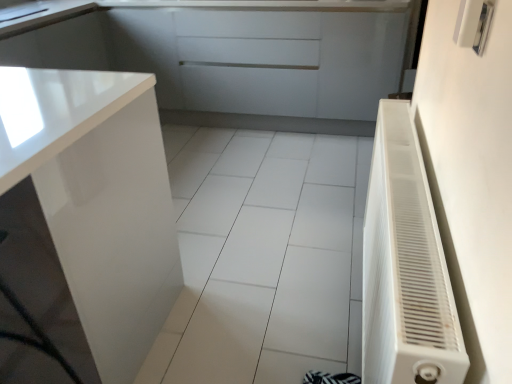
Question: Is glossy white cabinet at left, arranged as the first cabinetry when ordered from the bottom, located outside glossy white cabinet at upper left, marked as the 2th cabinetry in a bottom-to-top arrangement?

Choices:
 (A) no
 (B) yes

Answer: (B)

Question: Can glossy white cabinet at upper left, placed as the 2th cabinetry when sorted from front to back, be found inside glossy white cabinet at left, the 2th cabinetry when ordered from back to front?

Choices:
 (A) no
 (B) yes

Answer: (A)

Question: Is glossy white cabinet at upper left, placed as the 2th cabinetry when sorted from front to back, at the back of glossy white cabinet at left, which is the 2th cabinetry in top-to-bottom order?

Choices:
 (A) yes
 (B) no

Answer: (B)

Question: From the image's perspective, is glossy white cabinet at left, arranged as the first cabinetry when ordered from the bottom, beneath glossy white cabinet at upper left, marked as the first cabinetry in a back-to-front arrangement?

Choices:
 (A) no
 (B) yes

Answer: (B)

Question: Is glossy white cabinet at left, arranged as the first cabinetry when ordered from the bottom, thinner than glossy white cabinet at upper left, placed as the 2th cabinetry when sorted from front to back?

Choices:
 (A) no
 (B) yes

Answer: (A)

Question: Is glossy white cabinet at left, which is the 1th cabinetry in front-to-back order, placed right next to glossy white cabinet at upper left, marked as the first cabinetry in a back-to-front arrangement?

Choices:
 (A) no
 (B) yes

Answer: (A)

Question: Would you say white glossy sink at upper left is part of metallic silver switch at upper right's contents?

Choices:
 (A) no
 (B) yes

Answer: (A)

Question: From the image's perspective, is metallic silver switch at upper right located beneath white glossy sink at upper left?

Choices:
 (A) no
 (B) yes

Answer: (B)

Question: Is metallic silver switch at upper right positioned before white glossy sink at upper left?

Choices:
 (A) no
 (B) yes

Answer: (B)

Question: From a real-world perspective, is metallic silver switch at upper right beneath white glossy sink at upper left?

Choices:
 (A) no
 (B) yes

Answer: (A)

Question: Is metallic silver switch at upper right taller than white glossy sink at upper left?

Choices:
 (A) no
 (B) yes

Answer: (B)

Question: From the image's perspective, is metallic silver switch at upper right above white glossy sink at upper left?

Choices:
 (A) yes
 (B) no

Answer: (B)

Question: From a real-world perspective, is metallic silver switch at upper right beneath glossy white cabinet at upper left, placed as the 2th cabinetry when sorted from front to back?

Choices:
 (A) no
 (B) yes

Answer: (A)